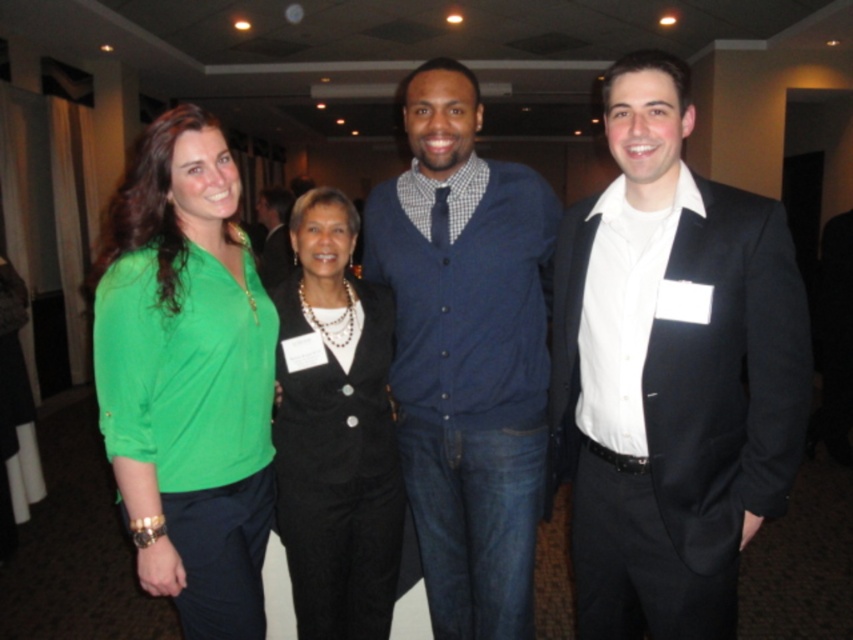
Question: Based on their relative distances, which object is nearer to the black satin suit at right?

Choices:
 (A) matte blue sweater at center
 (B) green fabric blouse at left
 (C) matte black blazer at center
 (D) black textured suit at center

Answer: (A)

Question: Does black satin suit at right have a greater width compared to matte blue sweater at center?

Choices:
 (A) no
 (B) yes

Answer: (A)

Question: Does matte blue sweater at center lie behind green fabric blouse at left?

Choices:
 (A) no
 (B) yes

Answer: (B)

Question: Considering the relative positions of matte blue sweater at center and matte black blazer at center in the image provided, where is matte blue sweater at center located with respect to matte black blazer at center?

Choices:
 (A) above
 (B) below

Answer: (B)

Question: Which object appears closest to the camera in this image?

Choices:
 (A) matte blue sweater at center
 (B) matte black blazer at center
 (C) black satin suit at right

Answer: (C)

Question: Which point is closer to the camera?

Choices:
 (A) matte black blazer at center
 (B) green fabric blouse at left
 (C) black satin suit at right
 (D) matte blue sweater at center

Answer: (B)